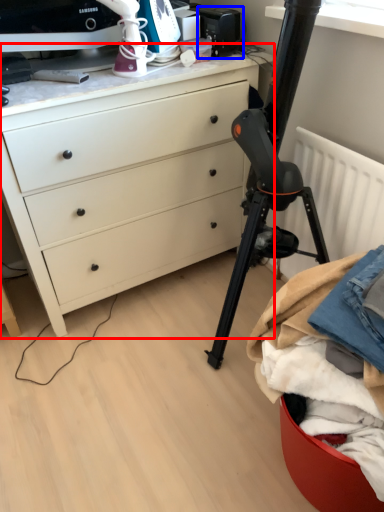
Question: Which object appears closest to the camera in this image, chest of drawers (highlighted by a red box) or appliance (highlighted by a blue box)?

Choices:
 (A) chest of drawers
 (B) appliance

Answer: (A)